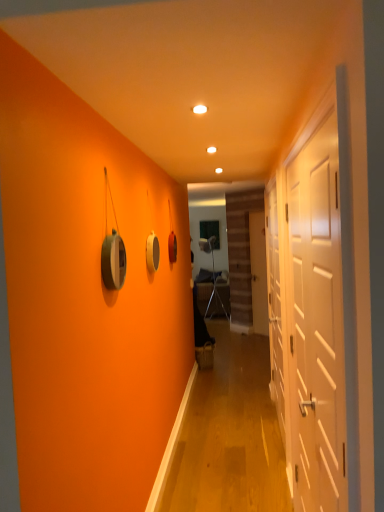
Find the location of a particular element. metallic silver armchair at center is located at coordinates (218, 296).

What do you see at coordinates (319, 314) in the screenshot? This screenshot has height=512, width=384. I see `white glossy door at right, placed as the 1th door when sorted from left to right` at bounding box center [319, 314].

Find the location of `white matte door at center, which is the 3th door from front to back`. white matte door at center, which is the 3th door from front to back is located at coordinates (258, 273).

You are a GUI agent. You are given a task and a screenshot of the screen. Output one action in this format:
    pyautogui.click(x=<x>, y=<y>)
    Task: Click on the metallic silver armchair at center
    The height and width of the screenshot is (512, 384).
    Given the screenshot: What is the action you would take?
    pyautogui.click(x=218, y=296)

In the image, there is a white glossy door at right, placed as the 1th door when sorted from left to right. In order to click on door above it (from the image's perspective) in this screenshot , I will do `click(258, 273)`.

Is white matte door at center, which is the 3th door from front to back, placed right next to white glossy door at right, which ranks as the 3th door in right-to-left order?

white matte door at center, which is the 3th door from front to back, is not next to white glossy door at right, which ranks as the 3th door in right-to-left order, and they're not touching.

Which is more to the right, white matte door at center, which appears as the first door when viewed from the right, or white glossy door at right, marked as the 1th door in a front-to-back arrangement?

white matte door at center, which appears as the first door when viewed from the right, is more to the right.

Looking at this image, between white matte door at center, which appears as the first door when viewed from the right, and metallic silver armchair at center, which one has smaller width?

white matte door at center, which appears as the first door when viewed from the right, is thinner.

In the scene shown: Which object is positioned more to the right, white matte door at center, which is the 1th door in back-to-front order, or metallic silver armchair at center?

white matte door at center, which is the 1th door in back-to-front order, is more to the right.

Can you see white matte door at center, which is the 3th door from front to back, touching metallic silver armchair at center?

No, white matte door at center, which is the 3th door from front to back, is not with metallic silver armchair at center.

How distant is white matte door at center, placed as the third door when sorted from left to right, from metallic silver armchair at center?

Result: white matte door at center, placed as the third door when sorted from left to right, is 1.10 meters away from metallic silver armchair at center.

Is white matte door at center, placed as the third door when sorted from left to right, in front of or behind white matte door at right, the second door viewed from the front, in the image?

Clearly, white matte door at center, placed as the third door when sorted from left to right, is behind white matte door at right, the second door viewed from the front.

Is white matte door at center, placed as the third door when sorted from left to right, facing away from white matte door at right, which is the second door from back to front?

white matte door at center, placed as the third door when sorted from left to right, is not turned away from white matte door at right, which is the second door from back to front.

Can you confirm if white matte door at center, which is the 3th door from front to back, is positioned to the right of white matte door at right, the second door viewed from the left?

Indeed, white matte door at center, which is the 3th door from front to back, is positioned on the right side of white matte door at right, the second door viewed from the left.

From a real-world perspective, is white matte door at center, which is the 1th door in back-to-front order, physically above white matte door at right, the second door viewed from the left?

Yes, from a real-world perspective, white matte door at center, which is the 1th door in back-to-front order, is above white matte door at right, the second door viewed from the left.

Considering the relative sizes of white matte door at right, which is the second door from back to front, and metallic silver armchair at center in the image provided, is white matte door at right, which is the second door from back to front, bigger than metallic silver armchair at center?

No, white matte door at right, which is the second door from back to front, is not bigger than metallic silver armchair at center.

Is white matte door at right, the second door viewed from the front, inside the boundaries of metallic silver armchair at center, or outside?

white matte door at right, the second door viewed from the front, is located beyond the bounds of metallic silver armchair at center.

Is white matte door at right, the second door viewed from the left, turned away from metallic silver armchair at center?

white matte door at right, the second door viewed from the left, does not have its back to metallic silver armchair at center.

Find the location of a particular element. armchair located on the right of white glossy door at right, marked as the 1th door in a front-to-back arrangement is located at coordinates 218,296.

Does white glossy door at right, the third door from the back, turn towards metallic silver armchair at center?

No, white glossy door at right, the third door from the back, is not turned towards metallic silver armchair at center.

Is white glossy door at right, which ranks as the 3th door in right-to-left order, next to metallic silver armchair at center?

white glossy door at right, which ranks as the 3th door in right-to-left order, and metallic silver armchair at center are not in contact.

From a real-world perspective, is white glossy door at right, which ranks as the 3th door in right-to-left order, below metallic silver armchair at center?

Actually, white glossy door at right, which ranks as the 3th door in right-to-left order, is physically above metallic silver armchair at center in the real world.

From a real-world perspective, does metallic silver armchair at center stand above white matte door at right, the second door viewed from the front?

No, from a real-world perspective, metallic silver armchair at center is not above white matte door at right, the second door viewed from the front.

Which object is positioned more to the right, metallic silver armchair at center or white matte door at right, which is the second door from back to front?

Positioned to the right is white matte door at right, which is the second door from back to front.

You are a GUI agent. You are given a task and a screenshot of the screen. Output one action in this format:
    pyautogui.click(x=<x>, y=<y>)
    Task: Click on the door that is the 1st object to the right of the metallic silver armchair at center, starting at the anchor
    
    Given the screenshot: What is the action you would take?
    pyautogui.click(x=275, y=304)

Is metallic silver armchair at center oriented towards white matte door at right, the second door viewed from the front?

No, metallic silver armchair at center does not turn towards white matte door at right, the second door viewed from the front.

From a real-world perspective, between white matte door at right, the second door viewed from the front, and white matte door at center, which is the 1th door in back-to-front order, who is vertically lower?

In real-world perspective, white matte door at right, the second door viewed from the front, is lower.

Which is further, (276, 312) or (259, 285)?

The point (259, 285) is farther from the camera.

Is white matte door at right, the second door viewed from the front, in front of white matte door at center, which appears as the first door when viewed from the right?

Yes, it is in front of white matte door at center, which appears as the first door when viewed from the right.

Considering the relative sizes of white matte door at right, the second door viewed from the left, and white matte door at center, placed as the third door when sorted from left to right, in the image provided, is white matte door at right, the second door viewed from the left, smaller than white matte door at center, placed as the third door when sorted from left to right,?

Yes.

From the image's perspective, count 1st doors downward from the white matte door at center, which is the 3th door from front to back, and point to it. Please provide its 2D coordinates.

[(319, 314)]

Starting from the metallic silver armchair at center, which door is the 1st one in front? Please provide its 2D coordinates.

[(258, 273)]

When comparing their distances from white glossy door at right, which ranks as the 3th door in right-to-left order, does white matte door at right, positioned as the second door in right-to-left order, or white matte door at center, placed as the third door when sorted from left to right, seem further?

white matte door at center, placed as the third door when sorted from left to right, is further to white glossy door at right, which ranks as the 3th door in right-to-left order.

Estimate the real-world distances between objects in this image. Which object is further from white glossy door at right, the third door from the back, metallic silver armchair at center or white matte door at center, placed as the third door when sorted from left to right?

metallic silver armchair at center is positioned further to the anchor white glossy door at right, the third door from the back.

Based on their spatial positions, is white matte door at right, the second door viewed from the left, or white glossy door at right, marked as the 1th door in a front-to-back arrangement, closer to white matte door at center, which appears as the first door when viewed from the right?

white matte door at right, the second door viewed from the left, lies closer to white matte door at center, which appears as the first door when viewed from the right, than the other object.

Considering their positions, is white matte door at right, positioned as the second door in right-to-left order, positioned further to metallic silver armchair at center than white glossy door at right, marked as the 1th door in a front-to-back arrangement?

white glossy door at right, marked as the 1th door in a front-to-back arrangement, is further to metallic silver armchair at center.

Looking at the image, which one is located further to white glossy door at right, marked as the 1th door in a front-to-back arrangement, metallic silver armchair at center or white matte door at right, the second door viewed from the left?

Based on the image, metallic silver armchair at center appears to be further to white glossy door at right, marked as the 1th door in a front-to-back arrangement.

From the image, which object appears to be farther from white glossy door at right, marked as the 1th door in a front-to-back arrangement, white matte door at right, positioned as the second door in right-to-left order, or metallic silver armchair at center?

Based on the image, metallic silver armchair at center appears to be further to white glossy door at right, marked as the 1th door in a front-to-back arrangement.

Which object lies nearer to the anchor point white matte door at right, the second door viewed from the front, white glossy door at right, marked as the 1th door in a front-to-back arrangement, or metallic silver armchair at center?

white glossy door at right, marked as the 1th door in a front-to-back arrangement.

When comparing their distances from white matte door at center, which is the 1th door in back-to-front order, does white matte door at right, the second door viewed from the left, or metallic silver armchair at center seem closer?

The object closer to white matte door at center, which is the 1th door in back-to-front order, is metallic silver armchair at center.

In order to click on door between white glossy door at right, the third door from the back, and white matte door at center, placed as the third door when sorted from left to right, from front to back in this screenshot , I will do `click(275, 304)`.

Where is `door located between white matte door at right, which is the second door from back to front, and metallic silver armchair at center in the depth direction`? Image resolution: width=384 pixels, height=512 pixels. door located between white matte door at right, which is the second door from back to front, and metallic silver armchair at center in the depth direction is located at coordinates (258, 273).